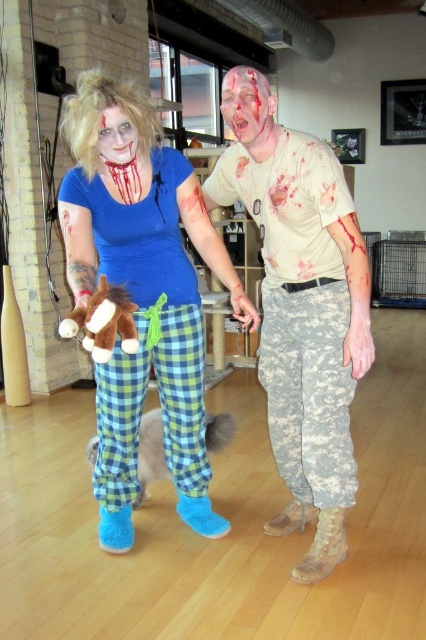
Is point (112, 310) positioned before point (264, 83)?

That is True.

Between brown plush toy at center and matte white face at center, which one appears on the right side from the viewer's perspective?

matte white face at center

Who is more distant from viewer, (123, 316) or (264, 108)?

Point (264, 108)

Identify the location of brown plush toy at center. Image resolution: width=426 pixels, height=640 pixels. (103, 321).

Does camouflage pants at center appear on the left side of matte white face at upper left?

No, camouflage pants at center is not to the left of matte white face at upper left.

What do you see at coordinates (299, 308) in the screenshot?
I see `camouflage pants at center` at bounding box center [299, 308].

This screenshot has height=640, width=426. I want to click on camouflage pants at center, so click(299, 308).

Can you confirm if fluffy fur cat at lower center is positioned below matte white face at center?

Yes.

Is fluffy fur cat at lower center wider than matte white face at center?

Yes, fluffy fur cat at lower center is wider than matte white face at center.

Does point (149, 465) come farther from viewer compared to point (267, 102)?

That is True.

What are the coordinates of `fluffy fur cat at lower center` in the screenshot? It's located at [x=149, y=452].